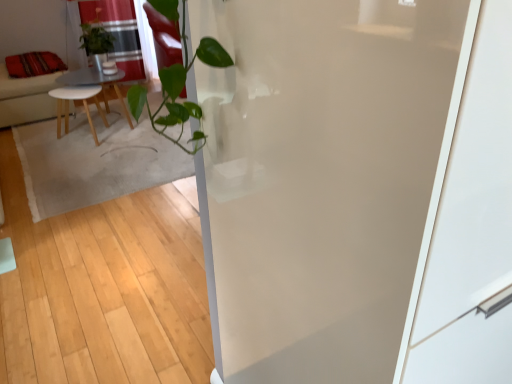
Measure the distance between point (101, 77) and camera.

They are 3.57 meters apart.

This screenshot has height=384, width=512. In order to click on wooden table at center in this screenshot , I will do [95, 82].

The image size is (512, 384). Identify the location of red fabric cushion at left. (26, 98).

This screenshot has width=512, height=384. Identify the location of velvet red pillow at upper left. (33, 64).

Considering the positions of objects wooden table at center and transparent glass screen door at center in the image provided, who is behind, wooden table at center or transparent glass screen door at center?

wooden table at center is further from the camera.

Which object is positioned more to the right, wooden table at center or transparent glass screen door at center?

From the viewer's perspective, transparent glass screen door at center appears more on the right side.

Is wooden table at center facing towards transparent glass screen door at center?

No, wooden table at center is not aimed at transparent glass screen door at center.

Consider the image. From a real-world perspective, relative to transparent glass screen door at center, is wooden table at center vertically above or below?

In terms of real-world spatial position, wooden table at center is above transparent glass screen door at center.

Is transparent glass screen door at center placed right next to red sheer curtain at upper left?

No, transparent glass screen door at center is not next to red sheer curtain at upper left.

Is red sheer curtain at upper left at the back of transparent glass screen door at center?

No.

From the image's perspective, is transparent glass screen door at center above or below red sheer curtain at upper left?

From the image's perspective, transparent glass screen door at center appears below red sheer curtain at upper left.

How many degrees apart are the facing directions of transparent glass screen door at center and red sheer curtain at upper left?

The angular difference between transparent glass screen door at center and red sheer curtain at upper left is 2.35 degrees.

Can you tell me how much red sheer curtain at upper left and wooden table at center differ in facing direction?

The angular difference between red sheer curtain at upper left and wooden table at center is 88.7 degrees.

Is red sheer curtain at upper left at the right side of wooden table at center?

No.

Is red sheer curtain at upper left spatially inside wooden table at center, or outside of it?

red sheer curtain at upper left cannot be found inside wooden table at center.

From a real-world perspective, which is physically above, red sheer curtain at upper left or wooden table at center?

red sheer curtain at upper left, from a real-world perspective.

Is transparent glass screen door at center surrounded by red sheer curtain at upper left?

No, transparent glass screen door at center is located outside of red sheer curtain at upper left.

Is red sheer curtain at upper left not close to transparent glass screen door at center?

Indeed, red sheer curtain at upper left is not near transparent glass screen door at center.

Is red sheer curtain at upper left to the left of transparent glass screen door at center from the viewer's perspective?

Yes.

Which object is further away from the camera, velvet red pillow at upper left or red sheer curtain at upper left?

red sheer curtain at upper left.

Which point is more forward, (8, 67) or (115, 55)?

The point (115, 55) is more forward.

Looking at this image, considering the sizes of objects velvet red pillow at upper left and red sheer curtain at upper left in the image provided, who is bigger, velvet red pillow at upper left or red sheer curtain at upper left?

With larger size is red sheer curtain at upper left.

Is velvet red pillow at upper left wider or thinner than red sheer curtain at upper left?

Clearly, velvet red pillow at upper left has more width compared to red sheer curtain at upper left.

In the scene shown: Measure the distance from wooden table at center to velvet red pillow at upper left.

A distance of 12.50 inches exists between wooden table at center and velvet red pillow at upper left.

Is point (83, 73) closer to viewer compared to point (58, 63)?

Yes, it is in front of point (58, 63).

From a real-world perspective, is wooden table at center under velvet red pillow at upper left?

Yes, from a real-world perspective, wooden table at center is beneath velvet red pillow at upper left.

From the picture: Is wooden table at center far from velvet red pillow at upper left?

No, wooden table at center is in close proximity to velvet red pillow at upper left.

Is velvet red pillow at upper left looking in the opposite direction of transparent glass screen door at center?

No, transparent glass screen door at center is not at the back of velvet red pillow at upper left.

From a real-world perspective, relative to transparent glass screen door at center, is velvet red pillow at upper left vertically above or below?

Clearly, from a real-world perspective, velvet red pillow at upper left is above transparent glass screen door at center.

Can you confirm if velvet red pillow at upper left is thinner than transparent glass screen door at center?

Yes.

Find the location of `screen door on the right of the wooden table at center`. screen door on the right of the wooden table at center is located at coordinates (324, 176).

In the image, there is a red sheer curtain at upper left. In order to click on screen door below it (from the image's perspective) in this screenshot , I will do `click(324, 176)`.

Estimate the real-world distances between objects in this image. Which object is further from transparent glass screen door at center, red sheer curtain at upper left or wooden table at center?

red sheer curtain at upper left is positioned further to the anchor transparent glass screen door at center.

Looking at the image, which one is located further to red fabric cushion at left, transparent glass screen door at center or velvet red pillow at upper left?

Based on the image, transparent glass screen door at center appears to be further to red fabric cushion at left.

Looking at the image, which one is located further to red fabric cushion at left, velvet red pillow at upper left or red sheer curtain at upper left?

The object further to red fabric cushion at left is red sheer curtain at upper left.

When comparing their distances from transparent glass screen door at center, does red fabric cushion at left or red sheer curtain at upper left seem further?

red fabric cushion at left.

In the scene shown: Considering their positions, is red fabric cushion at left positioned further to wooden table at center than transparent glass screen door at center?

The object further to wooden table at center is transparent glass screen door at center.

Based on their spatial positions, is transparent glass screen door at center or red fabric cushion at left further from wooden table at center?

transparent glass screen door at center is further to wooden table at center.

From the image, which object appears to be nearer to red fabric cushion at left, wooden table at center or transparent glass screen door at center?

Among the two, wooden table at center is located nearer to red fabric cushion at left.

Looking at the image, which one is located closer to red sheer curtain at upper left, velvet red pillow at upper left or red fabric cushion at left?

velvet red pillow at upper left.

At what (x,y) coordinates should I click in order to perform the action: click on table located between transparent glass screen door at center and velvet red pillow at upper left in the depth direction. Please return your answer as a coordinate pair (x, y). The width and height of the screenshot is (512, 384). Looking at the image, I should click on (95, 82).

This screenshot has height=384, width=512. I want to click on pillow between transparent glass screen door at center and red sheer curtain at upper left along the z-axis, so 33,64.

Where is `furniture between wooden table at center and red sheer curtain at upper left along the z-axis`? The image size is (512, 384). furniture between wooden table at center and red sheer curtain at upper left along the z-axis is located at coordinates (26, 98).

Where is `pillow located between red fabric cushion at left and wooden table at center in the left-right direction`? The image size is (512, 384). pillow located between red fabric cushion at left and wooden table at center in the left-right direction is located at coordinates (33, 64).